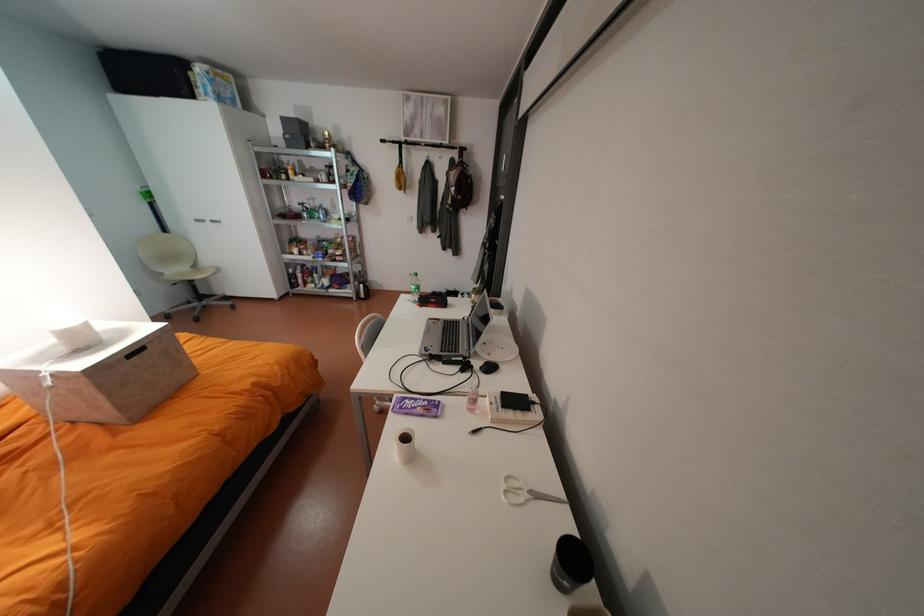
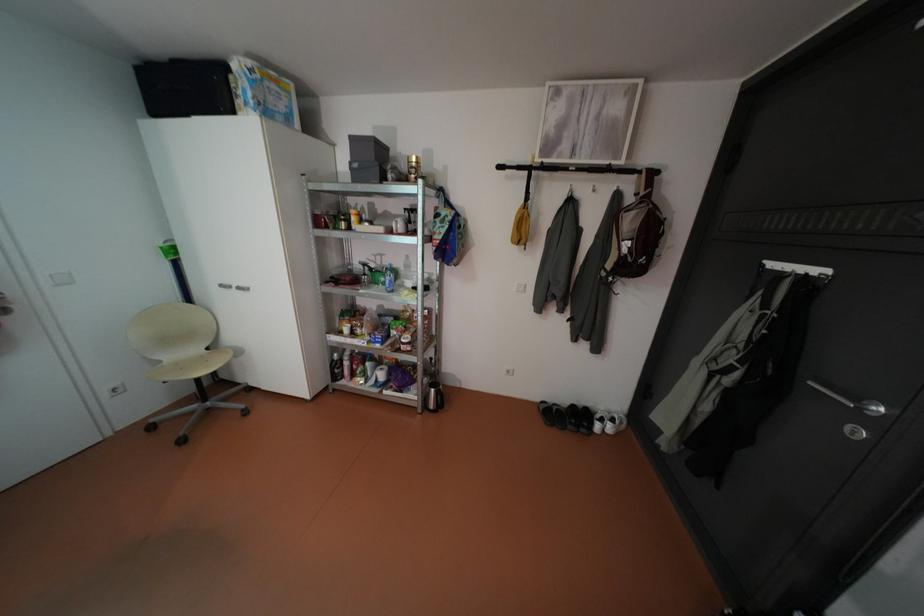
Locate, in the second image, the point that corresponds to [321,217] in the first image.

(383, 282)